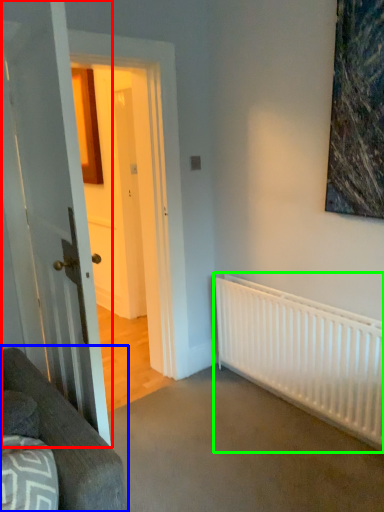
Question: Which object is positioned farthest from door (highlighted by a red box)? Select from studio couch (highlighted by a blue box) and radiator (highlighted by a green box).

Choices:
 (A) studio couch
 (B) radiator

Answer: (B)